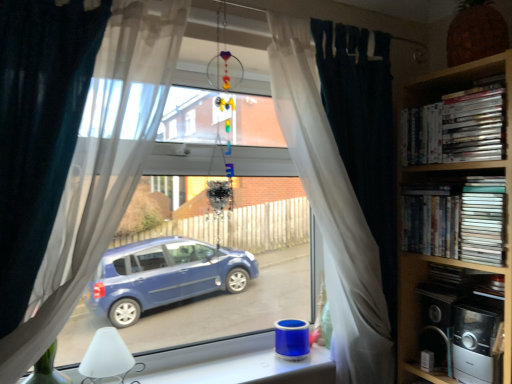
Question: Can you confirm if transparent glass window at lower center is thinner than metallic silver toaster at lower right, which is counted as the 1th appliance, starting from the front?

Choices:
 (A) yes
 (B) no

Answer: (B)

Question: Does transparent glass window at lower center lie in front of metallic silver toaster at lower right, which is counted as the 1th appliance, starting from the front?

Choices:
 (A) yes
 (B) no

Answer: (A)

Question: Considering the relative sizes of transparent glass window at lower center and metallic silver toaster at lower right, which appears as the 2th appliance when viewed from the back, in the image provided, is transparent glass window at lower center taller than metallic silver toaster at lower right, which appears as the 2th appliance when viewed from the back,?

Choices:
 (A) yes
 (B) no

Answer: (B)

Question: Can you confirm if transparent glass window at lower center is wider than metallic silver toaster at lower right, which is counted as the 1th appliance, starting from the front?

Choices:
 (A) yes
 (B) no

Answer: (A)

Question: Is transparent glass window at lower center not near metallic silver toaster at lower right, which appears as the 2th appliance when viewed from the back?

Choices:
 (A) yes
 (B) no

Answer: (B)

Question: Visually, is white glossy dvds at upper right, arranged as the first book when viewed from the top, positioned to the left or to the right of white matte lamp at lower left?

Choices:
 (A) right
 (B) left

Answer: (A)

Question: In terms of height, does white glossy dvds at upper right, placed as the third book when sorted from bottom to top, look taller or shorter compared to white matte lamp at lower left?

Choices:
 (A) short
 (B) tall

Answer: (B)

Question: From a real-world perspective, is white glossy dvds at upper right, placed as the third book when sorted from bottom to top, above or below white matte lamp at lower left?

Choices:
 (A) above
 (B) below

Answer: (A)

Question: Looking at the image, does white glossy dvds at upper right, placed as the third book when sorted from bottom to top, seem bigger or smaller compared to white matte lamp at lower left?

Choices:
 (A) big
 (B) small

Answer: (A)

Question: Is white matte lamp at lower left wider or thinner than metallic silver toaster at lower right, which is counted as the 1th appliance, starting from the front?

Choices:
 (A) wide
 (B) thin

Answer: (A)

Question: From a real-world perspective, relative to metallic silver toaster at lower right, which appears as the 2th appliance when viewed from the back, is white matte lamp at lower left vertically above or below?

Choices:
 (A) below
 (B) above

Answer: (A)

Question: Is white matte lamp at lower left to the left or to the right of metallic silver toaster at lower right, which is counted as the 1th appliance, starting from the front, in the image?

Choices:
 (A) right
 (B) left

Answer: (B)

Question: Looking at the image, does white matte lamp at lower left seem bigger or smaller compared to metallic silver toaster at lower right, which appears as the 2th appliance when viewed from the back?

Choices:
 (A) big
 (B) small

Answer: (A)

Question: Would you say white sheer curtain at center, arranged as the 2th curtain when viewed from the back, is inside or outside white glossy dvds at upper right, arranged as the first book when viewed from the top?

Choices:
 (A) outside
 (B) inside

Answer: (A)

Question: Considering the positions of point (92, 249) and point (439, 112), is point (92, 249) closer or farther from the camera than point (439, 112)?

Choices:
 (A) closer
 (B) farther

Answer: (A)